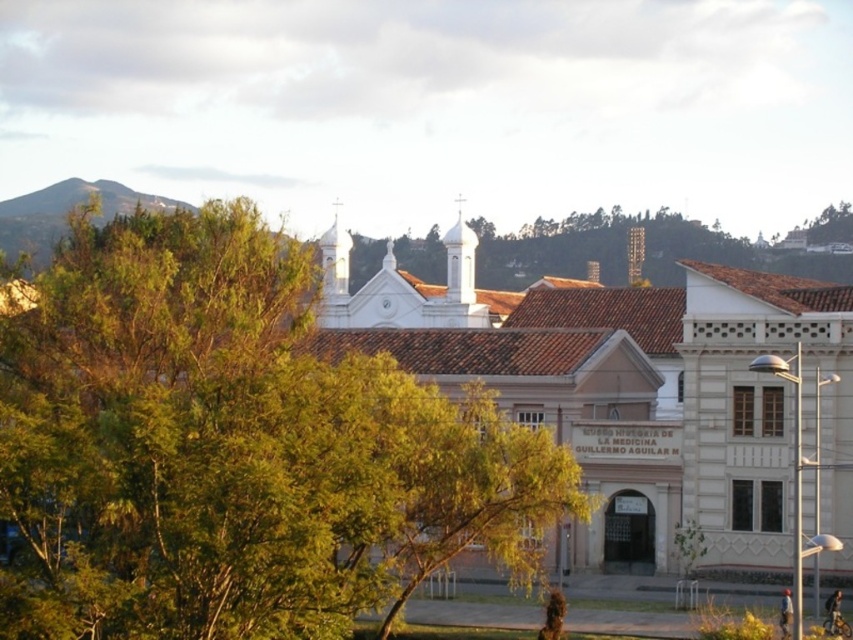
You are standing at the entrance of the MUSEO HISTORICO DE and want to take a photo of the white building with a terracotta tiled roof. However, the green leafy tree at center is blocking your view. Can you move to the left or right to get an unobstructed view of the building?

The green leafy tree at center is located at point (x=234, y=449), so moving to the left or right should allow you to position yourself where the tree no longer blocks the view of the white building with a terracotta tiled roof.

You are an architect analyzing the urban landscape. You notice the white smooth bell tower at upper center and the brick bell tower at upper center. Which of these two bell towers takes up less visual space in the composition?

The white smooth bell tower at upper center occupies less space than the brick bell tower at upper center, so it takes up less visual space in the composition.

You are an architect analyzing the layout of the buildings in the image. You notice two bell towers labeled as the white smooth bell tower at upper center and the brick bell tower at upper center. Which one appears closer to the viewer based on their spatial arrangement?

The white smooth bell tower at upper center is in front of the brick bell tower at upper center, so it appears closer to the viewer.